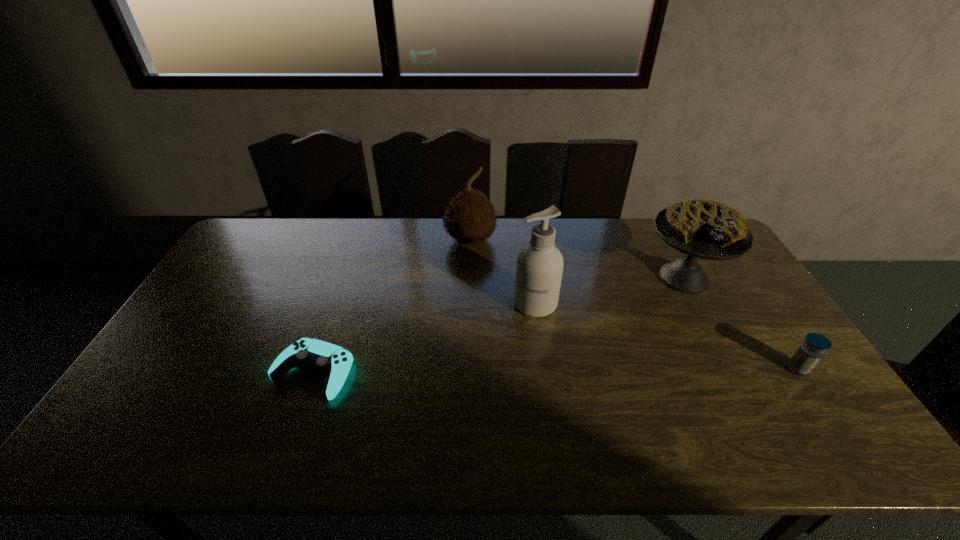
Find the location of a particular element. unoccupied position between the coconut and the leftmost object is located at coordinates (392, 306).

Identify which object is located as the nearest to the third object from right to left. Please provide its 2D coordinates. Your answer should be formatted as a tuple, i.e. [(x, y)], where the tuple contains the x and y coordinates of a point satisfying the conditions above.

[(469, 218)]

Find the location of `object that stands as the third closest to the cleansing agent`. object that stands as the third closest to the cleansing agent is located at coordinates (333, 362).

In order to click on free space in the image that satisfies the following two spatial constraints: 1. on the back side of the shortest object; 2. on the left side of the cleansing agent in this screenshot , I will do `click(337, 303)`.

The height and width of the screenshot is (540, 960). Identify the location of vacant space that satisfies the following two spatial constraints: 1. on the back side of the fourth tallest object; 2. on the right side of the control. (314, 369).

Locate an element on the screen. This screenshot has height=540, width=960. free space that satisfies the following two spatial constraints: 1. on the back side of the second shortest object; 2. on the left side of the shortest object is located at coordinates (314, 369).

Where is `free spot that satisfies the following two spatial constraints: 1. on the front side of the pie; 2. on the right side of the fourth tallest object`? free spot that satisfies the following two spatial constraints: 1. on the front side of the pie; 2. on the right side of the fourth tallest object is located at coordinates (732, 369).

The height and width of the screenshot is (540, 960). Identify the location of free location that satisfies the following two spatial constraints: 1. on the back side of the control; 2. on the right side of the second object from right to left. (346, 278).

Image resolution: width=960 pixels, height=540 pixels. Find the location of `blank space that satisfies the following two spatial constraints: 1. on the front side of the tallest object; 2. on the right side of the coconut`. blank space that satisfies the following two spatial constraints: 1. on the front side of the tallest object; 2. on the right side of the coconut is located at coordinates (468, 303).